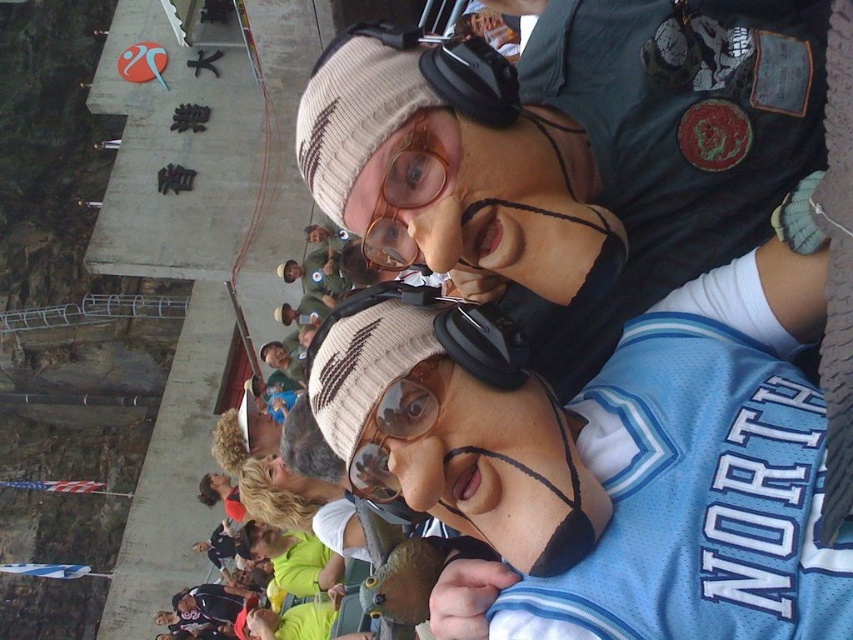
This screenshot has width=853, height=640. Find the location of `knit cap at upper center`. knit cap at upper center is located at coordinates pyautogui.click(x=573, y=156).

The width and height of the screenshot is (853, 640). In order to click on knit cap at upper center in this screenshot , I will do `click(573, 156)`.

Where is `knit cap at upper center`? knit cap at upper center is located at coordinates (573, 156).

Is knit cap at upper center taller than matte plastic goggles at center?

Indeed, knit cap at upper center has a greater height compared to matte plastic goggles at center.

Between knit cap at upper center and matte plastic goggles at center, which one is positioned higher?

knit cap at upper center is higher up.

Does point (561, 65) come behind point (396, 436)?

Yes, point (561, 65) is farther from viewer.

Where is `knit cap at upper center`? This screenshot has width=853, height=640. knit cap at upper center is located at coordinates (573, 156).

Between clear plastic goggles at center and matte plastic goggles at center, which one appears on the right side from the viewer's perspective?

matte plastic goggles at center

Who is higher up, clear plastic goggles at center or matte plastic goggles at center?

clear plastic goggles at center

Which is in front, point (357, 186) or point (407, 461)?

Point (407, 461) is more forward.

Find the location of `clear plastic goggles at center`. clear plastic goggles at center is located at coordinates (405, 186).